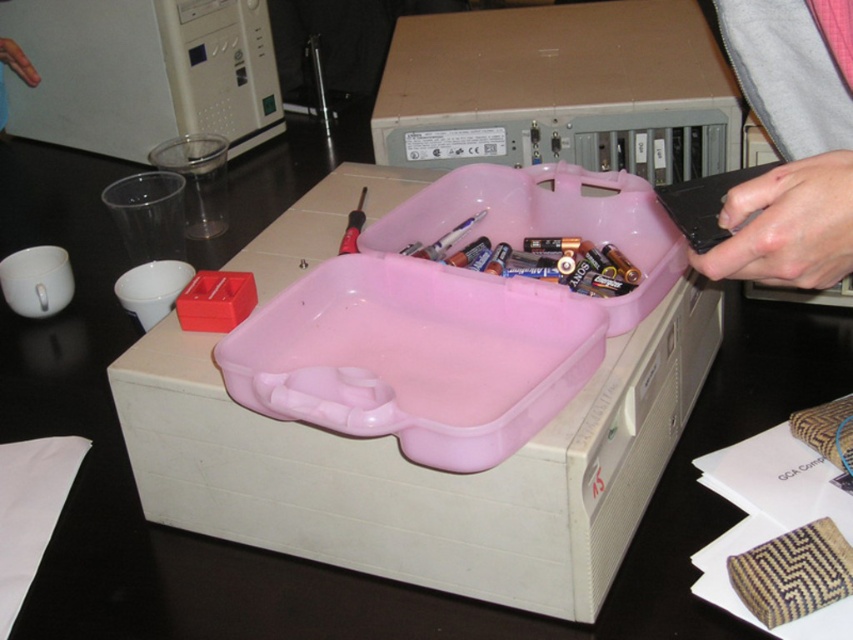
You are a delivery person who needs to place a new package on the table. The package is 3.5 feet wide. Can you fit it between the matte cardboard box at center and the edge of the table without moving any other items?

The distance between the matte cardboard box at center and the camera is 3.69 feet. Since the package is 3.5 feet wide, which is slightly less than the available space, you can fit it between the matte cardboard box at center and the edge of the table without moving other items.

You are standing in front of the workspace and want to place a new item between the two points, point (573, 72) and point (804, 45). Which point should you move the item closer to so it stays in front of the workspace?

You should move the item closer to point (573, 72) because it is closer to you than point (804, 45), so placing it near that point will keep it in front of the workspace.